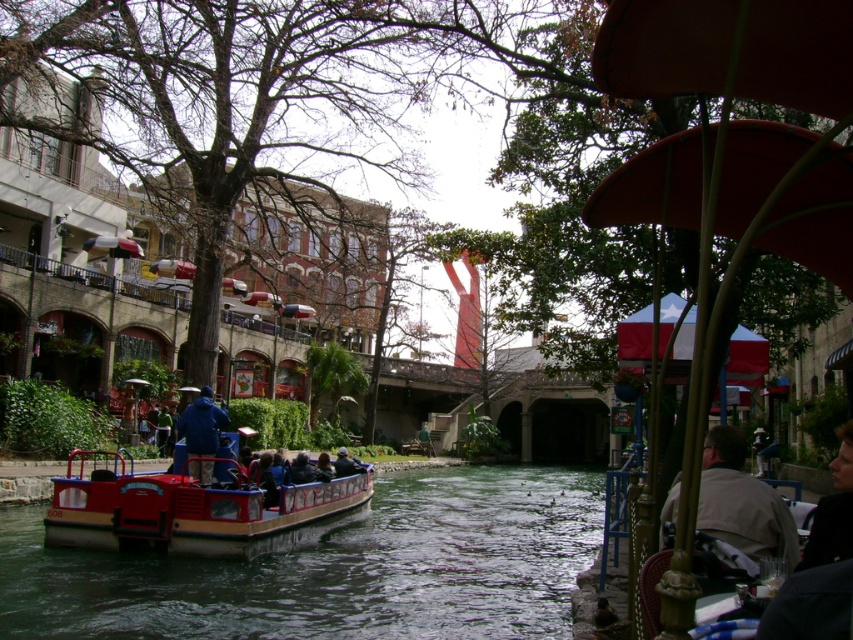
Does red plastic boat at center have a larger size compared to light brown leather jacket at lower right?

Indeed, red plastic boat at center has a larger size compared to light brown leather jacket at lower right.

I want to click on red plastic boat at center, so click(195, 512).

Does blue fabric jacket at center have a lesser width compared to dark blue fabric jacket at center?

Indeed, blue fabric jacket at center has a lesser width compared to dark blue fabric jacket at center.

Does blue fabric jacket at center have a lesser height compared to dark blue fabric jacket at center?

Yes, blue fabric jacket at center is shorter than dark blue fabric jacket at center.

Is point (183, 412) less distant than point (297, 474)?

No.

Identify the location of blue fabric jacket at center. click(201, 424).

Is point (323, 609) positioned behind point (209, 476)?

No, (323, 609) is in front of (209, 476).

Measure the distance between point (289, 556) and camera.

57.62 meters

Identify the location of smooth dark water at center. (335, 568).